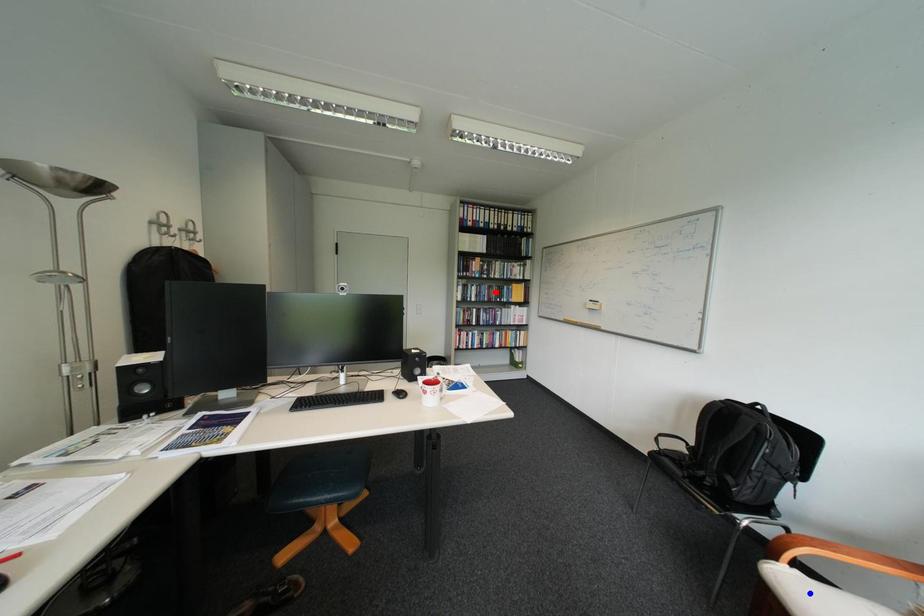
Question: Which of the two points in the image is closer to the camera?

Choices:
 (A) Blue point is closer.
 (B) Red point is closer.

Answer: (A)